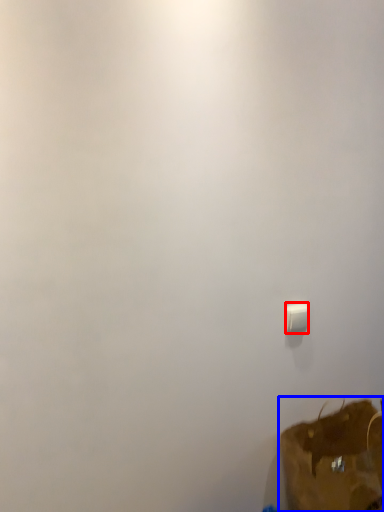
Question: Which of the following is the closest to the observer, light switch (highlighted by a red box) or luggage and bags (highlighted by a blue box)?

Choices:
 (A) light switch
 (B) luggage and bags

Answer: (B)